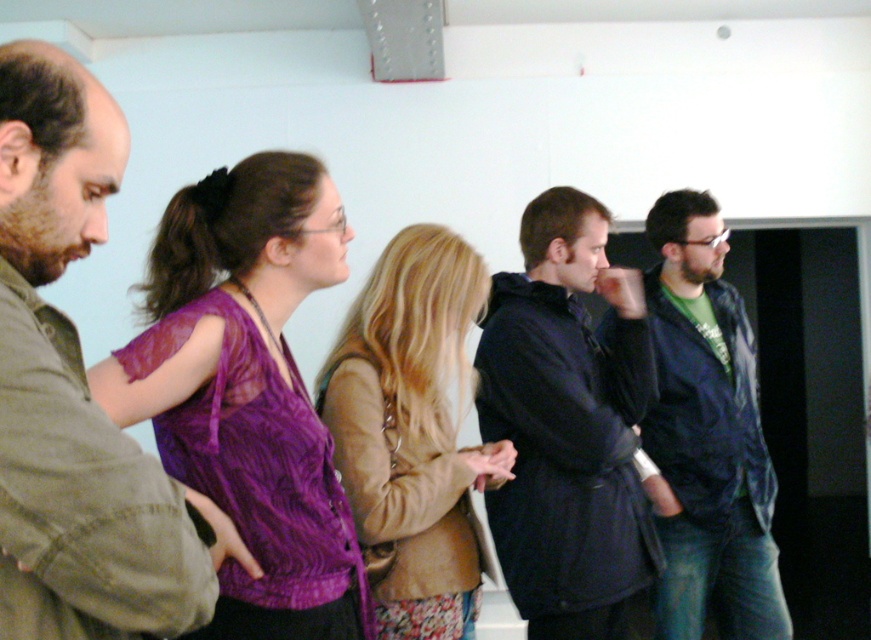
You are standing in the room and want to hand a document to both the matte green shirt at left and the purple sheer blouse at center. Since you can only move forward in a straight line, will you be able to reach both without changing direction?

The matte green shirt at left is 17.44 inches away from the purple sheer blouse at center, so if you move straight towards them, you can reach both as they are along the same path.

You are a photographer trying to capture a group photo of the dark blue coat at center and the dark blue jacket at right. The camera you are using has a minimum focus distance of 15 inches. Can you focus on both subjects simultaneously without moving either of them?

The distance between the dark blue coat at center and the dark blue jacket at right is 15.01 inches. Since the camera requires at least 15 inches, it is possible to focus on both subjects without moving them.

You are standing in the room and want to know which clothing item is wider between the matte green shirt at left and the purple sheer blouse at center. Which one is wider?

The purple sheer blouse at center is wider than the matte green shirt at left.